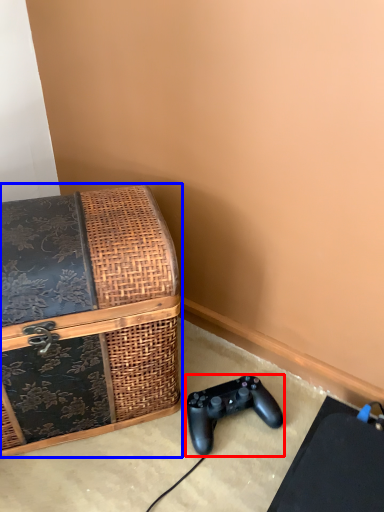
Question: Among these objects, which one is farthest to the camera, game controller (highlighted by a red box) or box (highlighted by a blue box)?

Choices:
 (A) game controller
 (B) box

Answer: (A)